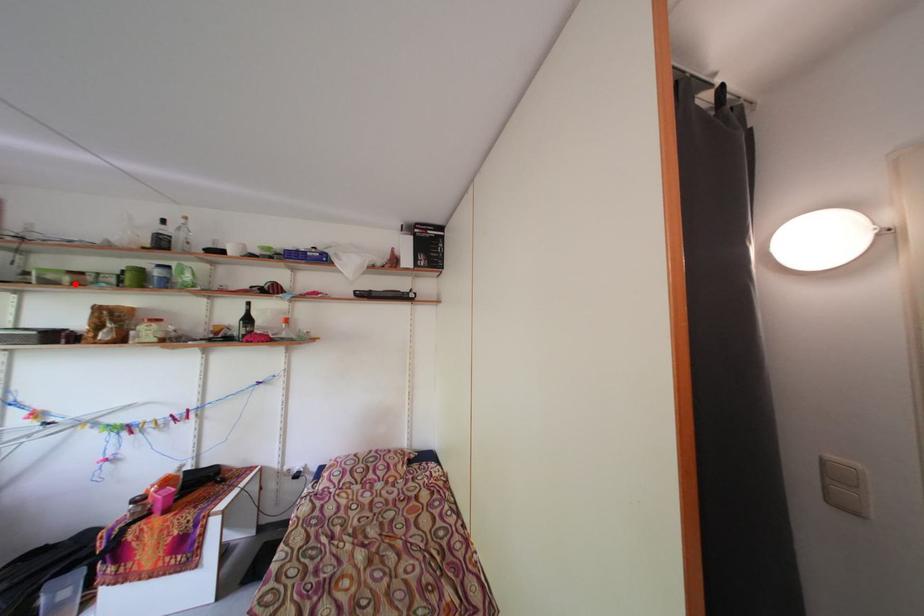
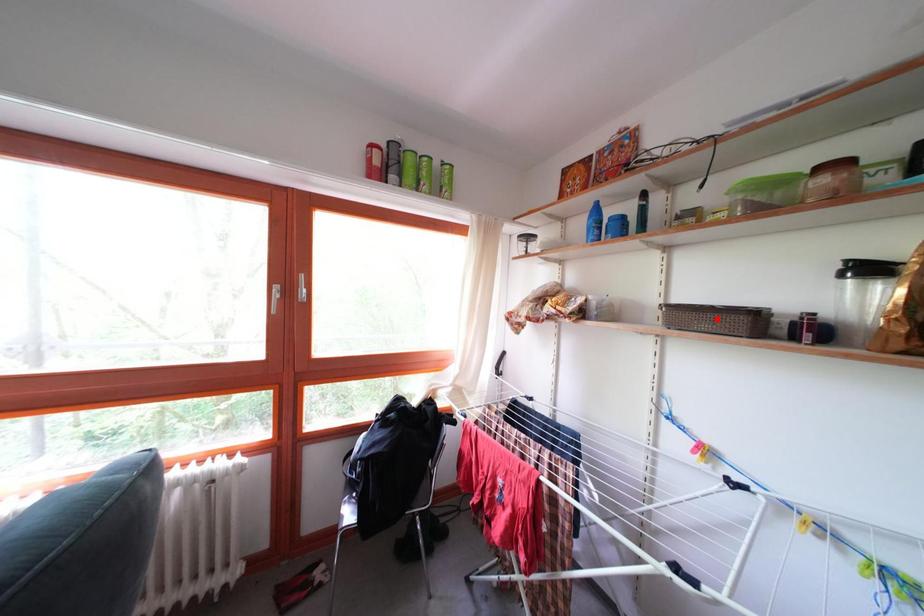
I am providing you with two images of the same scene from different viewpoints. A red point is marked on the first image and another point is marked on the second image. Are the points marked in image1 and image2 representing the same 3D position?

No